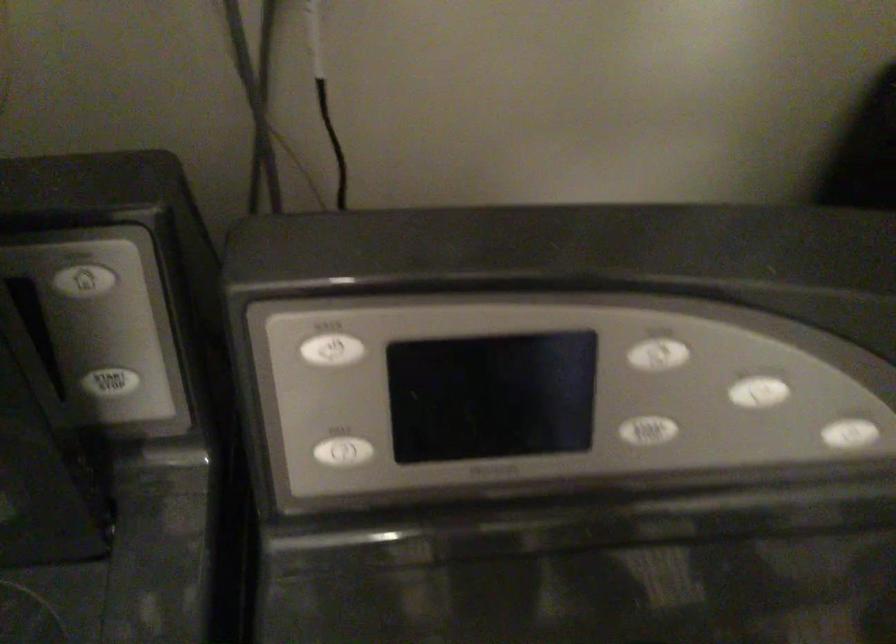
At what (x,y) coordinates should I click in order to perform the action: click on white home button. Please return your answer as a coordinate pair (x, y). The width and height of the screenshot is (896, 644). Looking at the image, I should click on (757, 392).